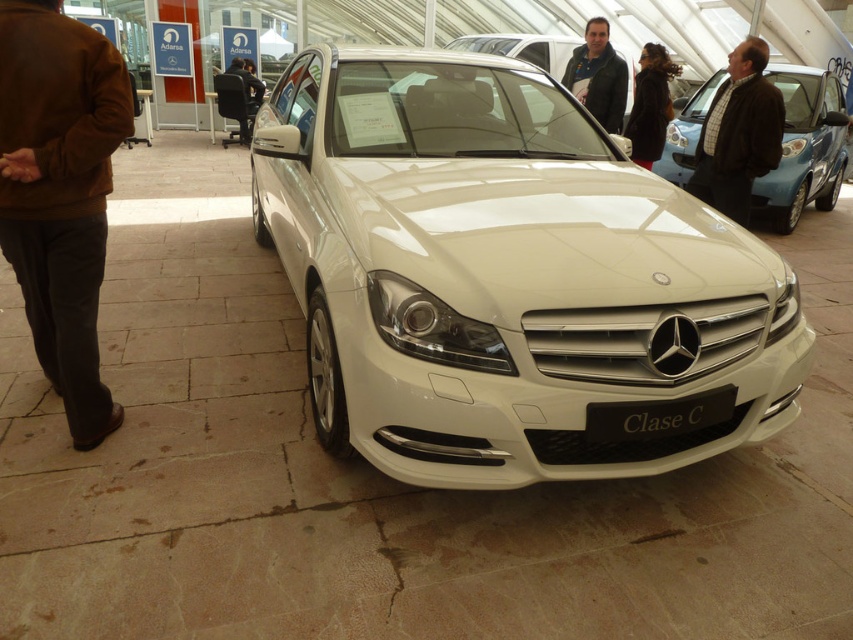
Consider the image. Is white glossy car at center shorter than brown suede jacket at left?

No, white glossy car at center is not shorter than brown suede jacket at left.

Between white glossy car at center and brown suede jacket at left, which one appears on the left side from the viewer's perspective?

brown suede jacket at left

Is point (465, 392) positioned in front of point (4, 138)?

Yes, point (465, 392) is closer to viewer.

Where is `white glossy car at center`? This screenshot has height=640, width=853. white glossy car at center is located at coordinates (503, 275).

Image resolution: width=853 pixels, height=640 pixels. What do you see at coordinates (738, 132) in the screenshot?
I see `brown plaid shirt at center` at bounding box center [738, 132].

Is point (753, 109) behind point (614, 435)?

Yes, it is behind point (614, 435).

Find the location of `brown plaid shirt at center`. brown plaid shirt at center is located at coordinates (738, 132).

Consider the image. Is matte blue car at right positioned at the back of black fur coat at upper center?

Yes, matte blue car at right is behind black fur coat at upper center.

Is matte blue car at right to the left of black fur coat at upper center from the viewer's perspective?

In fact, matte blue car at right is to the right of black fur coat at upper center.

Describe the element at coordinates (804, 147) in the screenshot. I see `matte blue car at right` at that location.

Where is `matte blue car at right`? matte blue car at right is located at coordinates (804, 147).